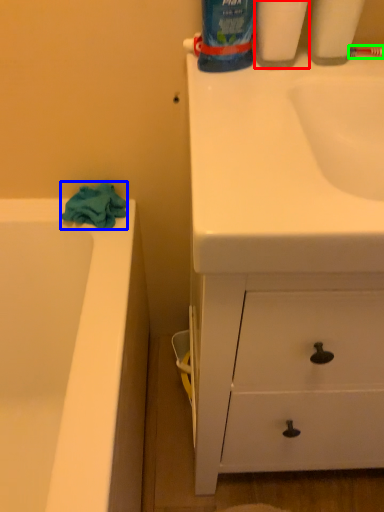
Question: Estimate the real-world distances between objects in this image. Which object is farther from cleaning product (highlighted by a red box), bath towel (highlighted by a blue box) or toothbrush (highlighted by a green box)?

Choices:
 (A) bath towel
 (B) toothbrush

Answer: (A)